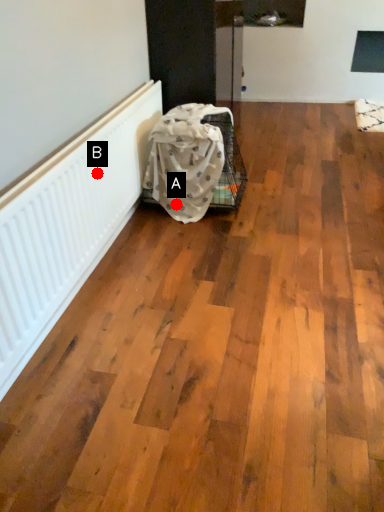
Question: Two points are circled on the image, labeled by A and B beside each circle. Which point is closer to the camera?

Choices:
 (A) A is closer
 (B) B is closer

Answer: (B)